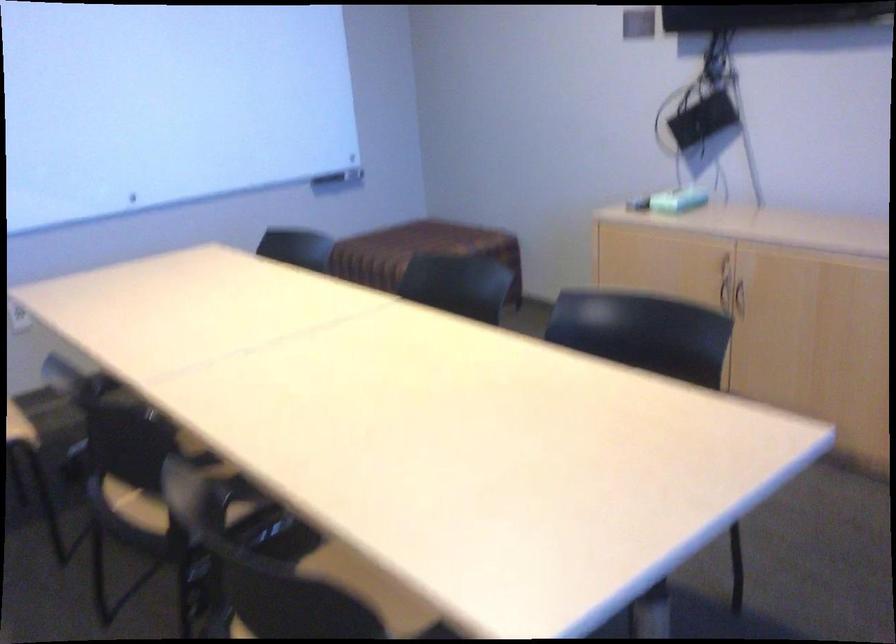
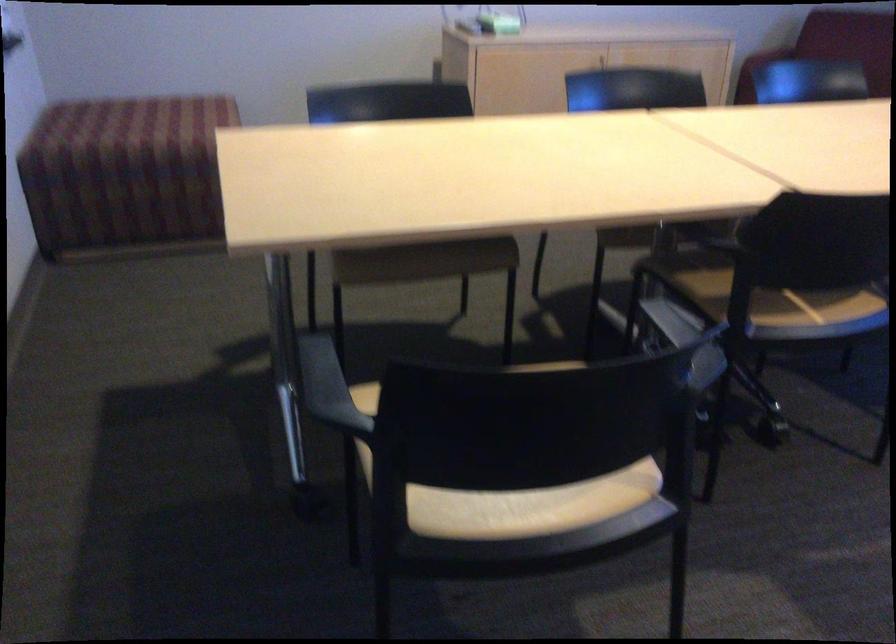
Where in the second image is the point corresponding to (204,483) from the first image?

(812, 301)